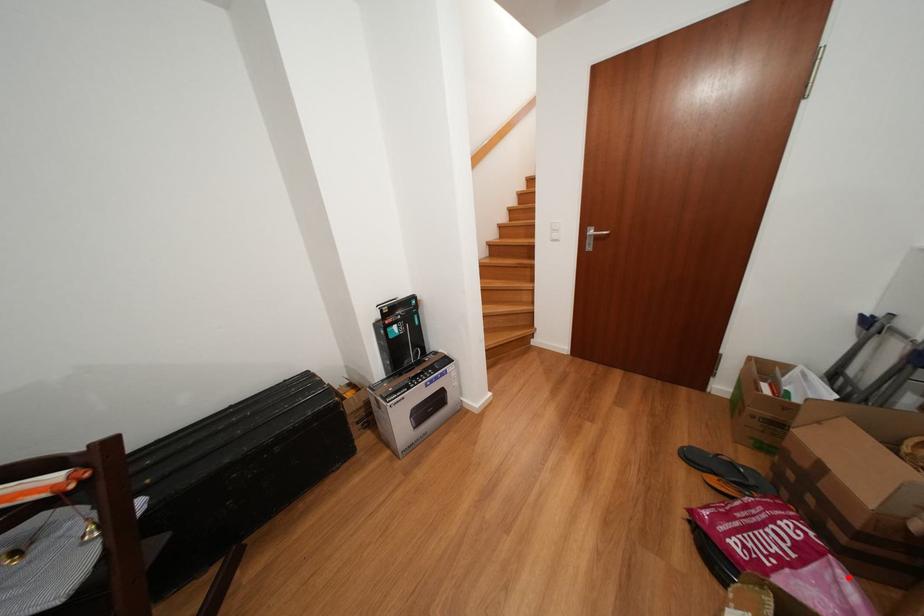
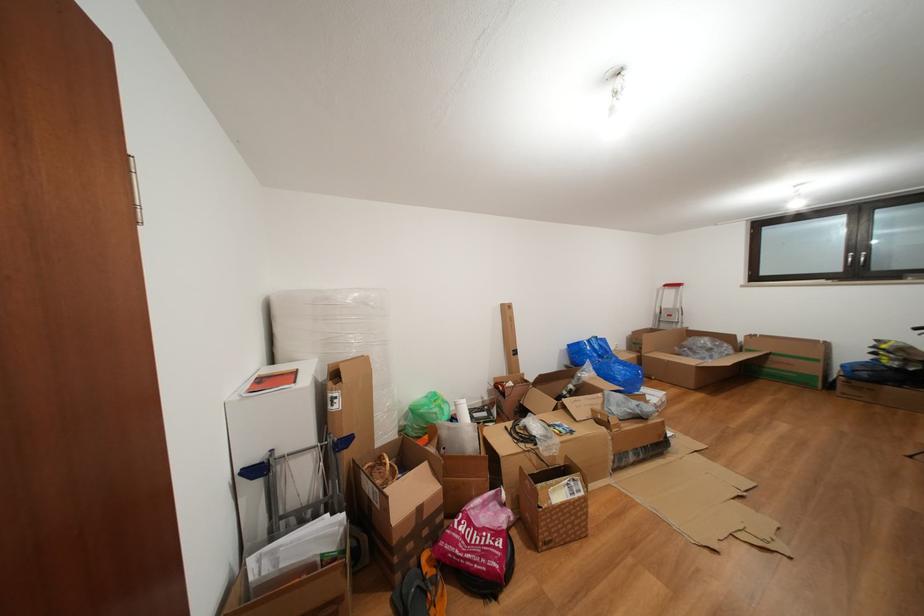
Find the pixel in the second image that matches the highlighted location in the first image.

(480, 511)